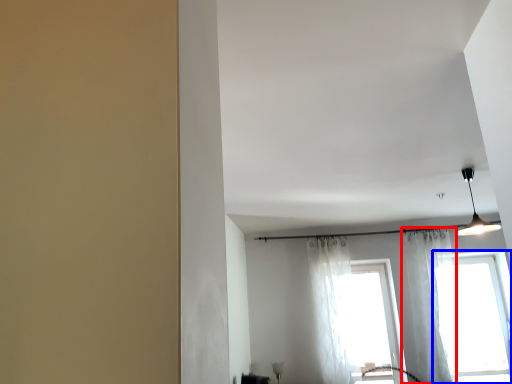
Question: Which of the following is the farthest to the observer, curtain (highlighted by a red box) or window (highlighted by a blue box)?

Choices:
 (A) curtain
 (B) window

Answer: (B)